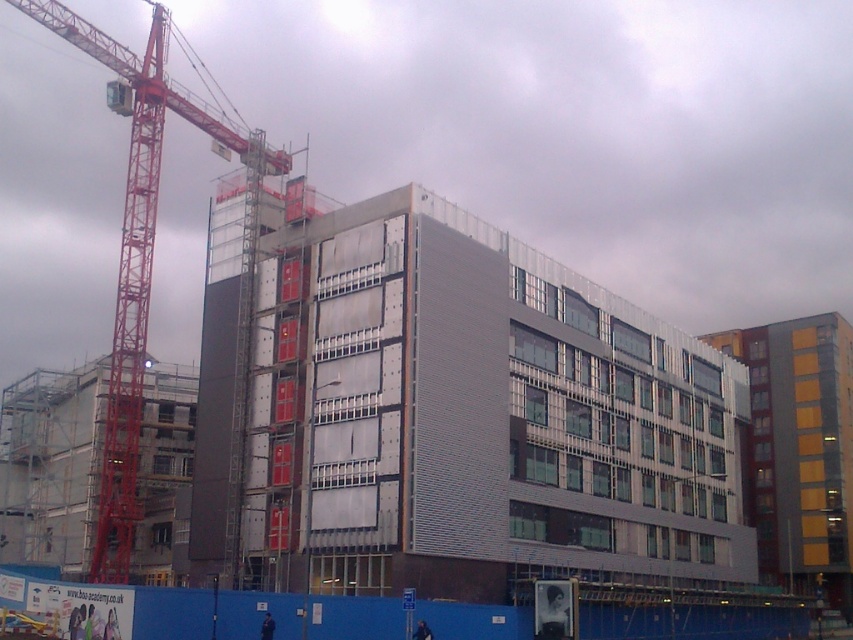
Question: Can you confirm if blue plastic fence at lower center is bigger than red metal crane at left?

Choices:
 (A) no
 (B) yes

Answer: (A)

Question: Which point is farther to the camera?

Choices:
 (A) (131, 248)
 (B) (306, 253)
 (C) (73, 618)

Answer: (A)

Question: Which object is farther from the camera taking this photo?

Choices:
 (A) blue plastic fence at lower center
 (B) red metal crane at left
 (C) metallic gray building at center

Answer: (B)

Question: Can you confirm if metallic gray building at center is bigger than red metal crane at left?

Choices:
 (A) yes
 (B) no

Answer: (B)

Question: Which object appears closest to the camera in this image?

Choices:
 (A) blue plastic fence at lower center
 (B) red metal crane at left
 (C) metallic gray building at center

Answer: (A)

Question: Does blue plastic fence at lower center have a smaller size compared to red metal crane at left?

Choices:
 (A) yes
 (B) no

Answer: (A)